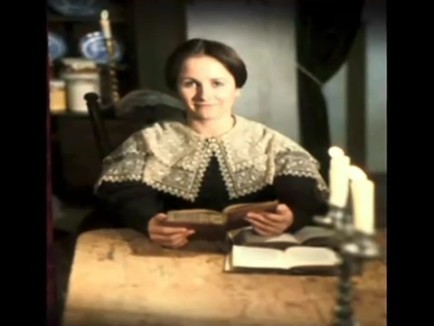
This screenshot has height=326, width=434. I want to click on candlestick, so click(x=113, y=79).